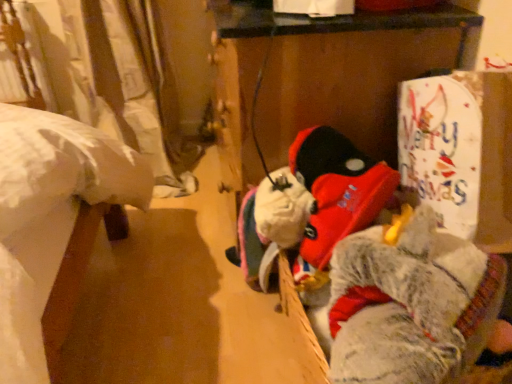
Measure the distance between point (341,268) and camera.

The distance of point (341,268) from camera is 32.36 inches.

The width and height of the screenshot is (512, 384). What do you see at coordinates (411, 305) in the screenshot?
I see `fuzzy gray stuffed animal at right` at bounding box center [411, 305].

You are a GUI agent. You are given a task and a screenshot of the screen. Output one action in this format:
    pyautogui.click(x=<x>, y=<y>)
    Task: Click on the fuzzy gray stuffed animal at right
    The height and width of the screenshot is (384, 512).
    Given the screenshot: What is the action you would take?
    pyautogui.click(x=411, y=305)

At what (x,y) coordinates should I click in order to perform the action: click on white paper sign at upper right. Please return your answer as a coordinate pair (x, y). The width and height of the screenshot is (512, 384). Looking at the image, I should click on (460, 152).

Image resolution: width=512 pixels, height=384 pixels. What do you see at coordinates (460, 152) in the screenshot? I see `white paper sign at upper right` at bounding box center [460, 152].

The image size is (512, 384). Identify the location of fuzzy gray stuffed animal at right. (411, 305).

Between white paper sign at upper right and fuzzy gray stuffed animal at right, which one appears on the right side from the viewer's perspective?

white paper sign at upper right is more to the right.

Is white paper sign at upper right in front of or behind fuzzy gray stuffed animal at right in the image?

white paper sign at upper right is behind fuzzy gray stuffed animal at right.

Which is farther, (507, 122) or (420, 209)?

Point (420, 209)

From the image's perspective, which object appears higher, white paper sign at upper right or fuzzy gray stuffed animal at right?

From the image's view, white paper sign at upper right is above.

From a real-world perspective, is white paper sign at upper right positioned above or below fuzzy gray stuffed animal at right?

Clearly, from a real-world perspective, white paper sign at upper right is above fuzzy gray stuffed animal at right.

Considering the sizes of objects white paper sign at upper right and fuzzy gray stuffed animal at right in the image provided, who is thinner, white paper sign at upper right or fuzzy gray stuffed animal at right?

Thinner between the two is white paper sign at upper right.

From the picture: In terms of height, does white paper sign at upper right look taller or shorter compared to fuzzy gray stuffed animal at right?

Clearly, white paper sign at upper right is shorter compared to fuzzy gray stuffed animal at right.

Based on their sizes in the image, would you say white paper sign at upper right is bigger or smaller than fuzzy gray stuffed animal at right?

Clearly, white paper sign at upper right is smaller in size than fuzzy gray stuffed animal at right.

Based on the photo, is fuzzy gray stuffed animal at right inside white paper sign at upper right?

Definitely not — fuzzy gray stuffed animal at right is not inside white paper sign at upper right.

Is the surface of white paper sign at upper right in direct contact with fuzzy gray stuffed animal at right?

There is a gap between white paper sign at upper right and fuzzy gray stuffed animal at right.

Is white paper sign at upper right positioned with its back to fuzzy gray stuffed animal at right?

No, fuzzy gray stuffed animal at right is not at the back of white paper sign at upper right.

How different are the orientations of white paper sign at upper right and fuzzy gray stuffed animal at right in degrees?

There is a 7.59e-06-degree angle between the facing directions of white paper sign at upper right and fuzzy gray stuffed animal at right.

At what (x,y) coordinates should I click in order to perform the action: click on animal located below the white paper sign at upper right (from the image's perspective). Please return your answer as a coordinate pair (x, y). The width and height of the screenshot is (512, 384). Looking at the image, I should click on (411, 305).

Is fuzzy gray stuffed animal at right to the left of white paper sign at upper right from the viewer's perspective?

Yes.

Which is in front, fuzzy gray stuffed animal at right or white paper sign at upper right?

fuzzy gray stuffed animal at right is in front.

Is point (400, 263) positioned before point (457, 123)?

Yes, point (400, 263) is in front of point (457, 123).

From the image's perspective, between fuzzy gray stuffed animal at right and white paper sign at upper right, who is located below?

From the image's view, fuzzy gray stuffed animal at right is below.

From a real-world perspective, between fuzzy gray stuffed animal at right and white paper sign at upper right, who is vertically lower?

fuzzy gray stuffed animal at right, from a real-world perspective.

Is fuzzy gray stuffed animal at right wider than white paper sign at upper right?

Yes, fuzzy gray stuffed animal at right is wider than white paper sign at upper right.

Looking at this image, from their relative heights in the image, would you say fuzzy gray stuffed animal at right is taller or shorter than white paper sign at upper right?

Considering their sizes, fuzzy gray stuffed animal at right has more height than white paper sign at upper right.

From the picture: Considering the relative sizes of fuzzy gray stuffed animal at right and white paper sign at upper right in the image provided, is fuzzy gray stuffed animal at right bigger than white paper sign at upper right?

Yes, fuzzy gray stuffed animal at right is bigger than white paper sign at upper right.

Is fuzzy gray stuffed animal at right completely or partially outside of white paper sign at upper right?

Indeed, fuzzy gray stuffed animal at right is completely outside white paper sign at upper right.

Based on the photo, is fuzzy gray stuffed animal at right in contact with white paper sign at upper right?

No, fuzzy gray stuffed animal at right is not touching white paper sign at upper right.

Is fuzzy gray stuffed animal at right facing towards white paper sign at upper right?

No, fuzzy gray stuffed animal at right does not turn towards white paper sign at upper right.

In the scene shown: How different are the orientations of fuzzy gray stuffed animal at right and white paper sign at upper right in degrees?

7.59e-06 degrees separate the facing orientations of fuzzy gray stuffed animal at right and white paper sign at upper right.

The width and height of the screenshot is (512, 384). What are the coordinates of `cardboard box on the right side of fuzzy gray stuffed animal at right` in the screenshot? It's located at (460, 152).

At what (x,y) coordinates should I click in order to perform the action: click on animal below the white paper sign at upper right (from the image's perspective). Please return your answer as a coordinate pair (x, y). The image size is (512, 384). Looking at the image, I should click on (411, 305).

Where is `animal below the white paper sign at upper right (from a real-world perspective)`? animal below the white paper sign at upper right (from a real-world perspective) is located at coordinates (411, 305).